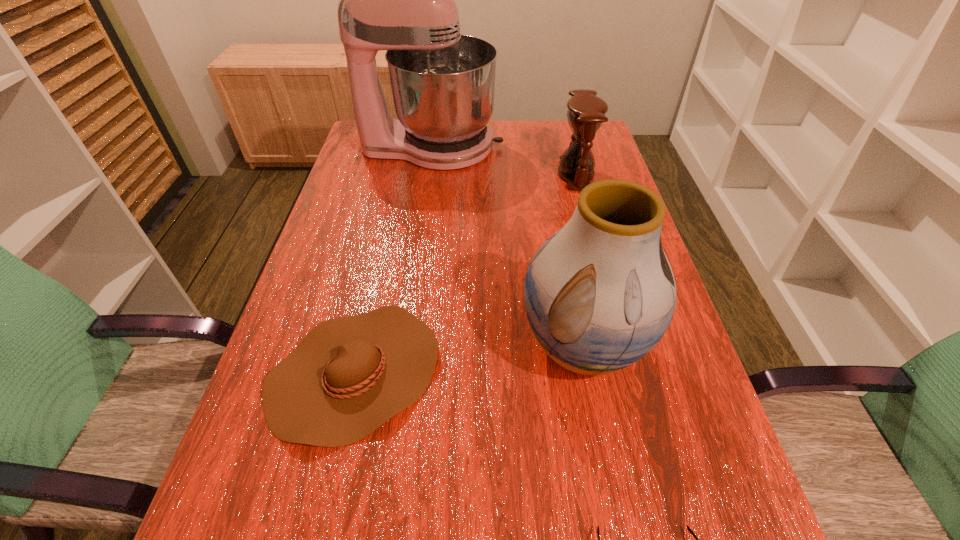
This screenshot has height=540, width=960. What are the coordinates of `mixer situated at the left edge` in the screenshot? It's located at (402, 0).

Image resolution: width=960 pixels, height=540 pixels. Identify the location of cowboy hat located at the left edge. (349, 375).

This screenshot has height=540, width=960. I want to click on vase positioned at the right edge, so click(x=600, y=293).

You are a GUI agent. You are given a task and a screenshot of the screen. Output one action in this format:
    pyautogui.click(x=<x>, y=<y>)
    Task: Click on the hourglass that is at the right edge
    The width and height of the screenshot is (960, 540).
    Given the screenshot: What is the action you would take?
    pyautogui.click(x=586, y=112)

This screenshot has height=540, width=960. What are the coordinates of `object present at the far left corner` in the screenshot? It's located at (402, 0).

You are a GUI agent. You are given a task and a screenshot of the screen. Output one action in this format:
    pyautogui.click(x=<x>, y=<y>)
    Task: Click on the object that is at the far right corner
    
    Given the screenshot: What is the action you would take?
    [x=586, y=112]

The width and height of the screenshot is (960, 540). I want to click on free space at the left edge, so click(x=374, y=175).

Locate an element on the screen. The width and height of the screenshot is (960, 540). free space between the third shortest object and the mixer is located at coordinates click(504, 160).

At what (x,y) coordinates should I click in order to perform the action: click on vacant point located between the cowboy hat and the mixer. Please return your answer as a coordinate pair (x, y). Looking at the image, I should click on (394, 260).

Image resolution: width=960 pixels, height=540 pixels. I want to click on empty space between the cowboy hat and the mixer, so click(x=394, y=260).